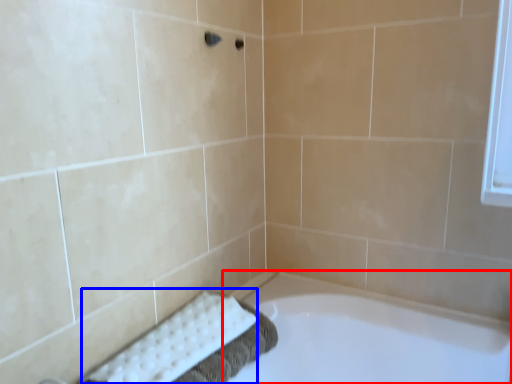
Question: Which object is closer to the camera taking this photo, bathtub (highlighted by a red box) or bath towel (highlighted by a blue box)?

Choices:
 (A) bathtub
 (B) bath towel

Answer: (A)